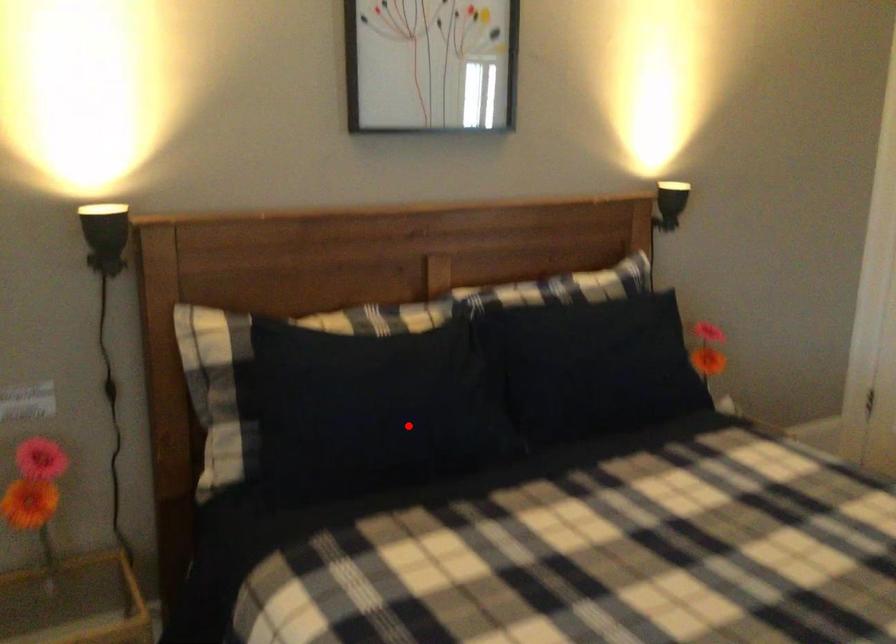
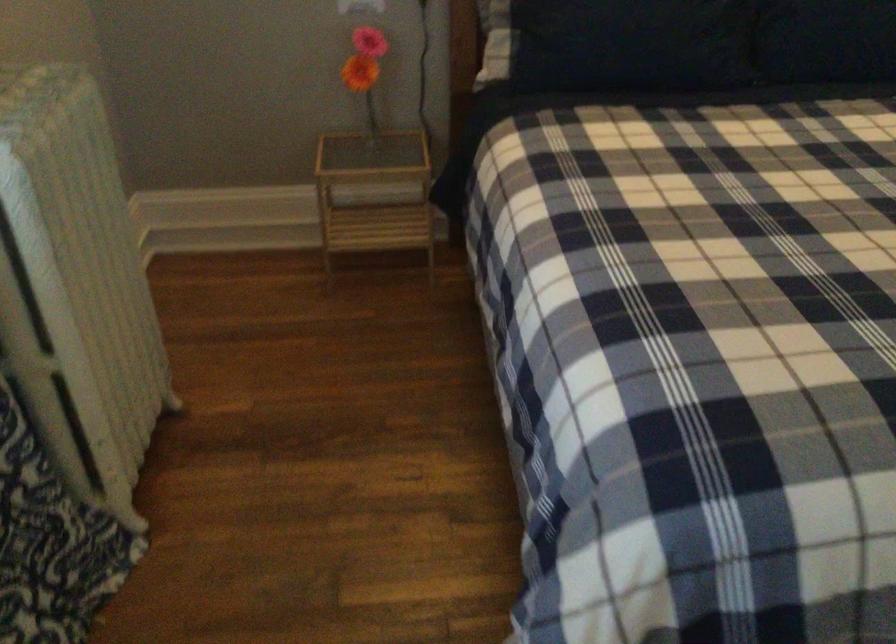
Question: A red point is marked in image1. In image2, is the corresponding 3D point closer to the camera or farther? Reply with the corresponding letter.

Choices:
 (A) The corresponding 3D point is closer.
 (B) The corresponding 3D point is farther.

Answer: (B)